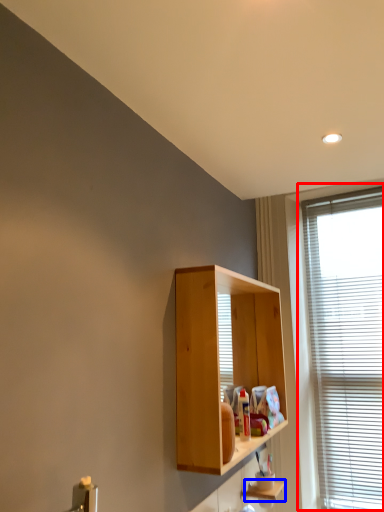
Question: Among these objects, which one is farthest to the camera, window (highlighted by a red box) or shelf (highlighted by a blue box)?

Choices:
 (A) window
 (B) shelf

Answer: (A)